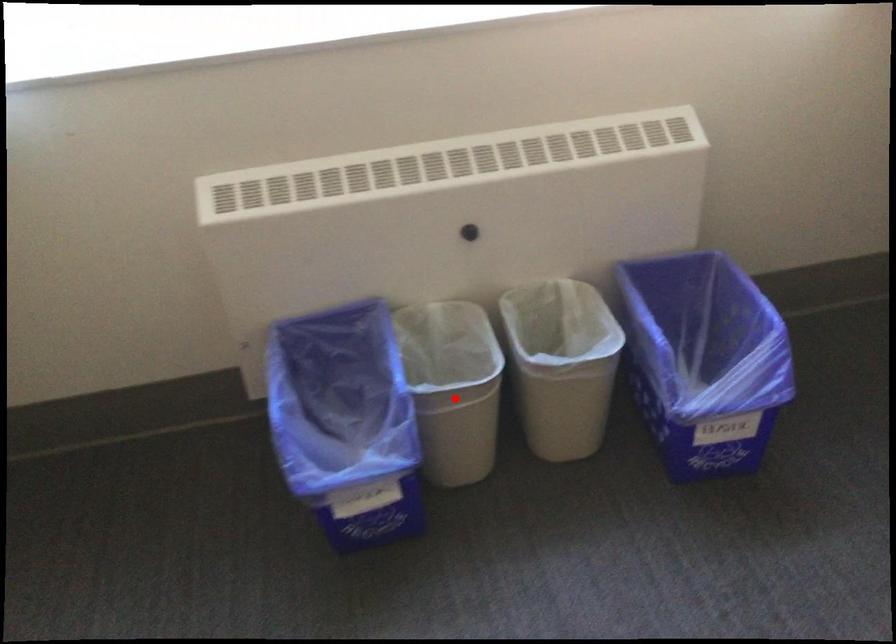
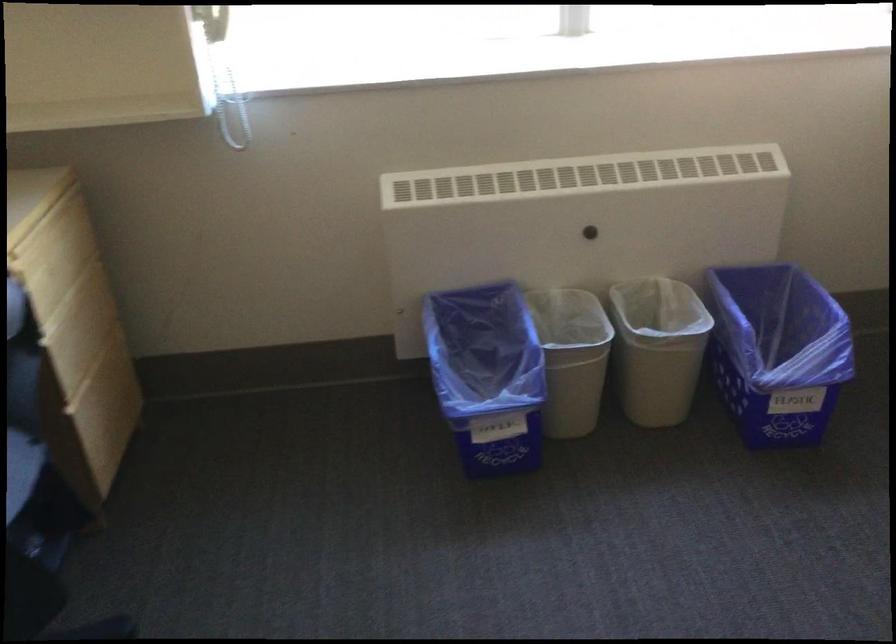
Locate, in the second image, the point that corresponds to the highlighted location in the first image.

(571, 357)